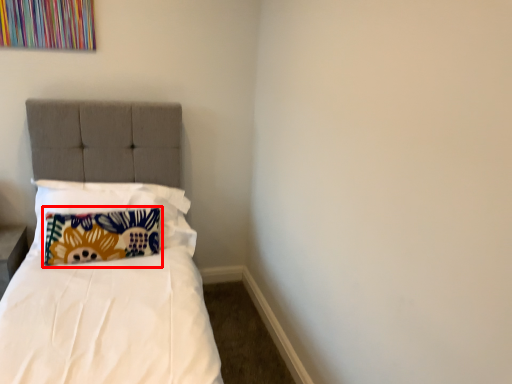
Question: From the image's perspective, where is pillow (annotated by the red box) located relative to pillow?

Choices:
 (A) below
 (B) above

Answer: (A)